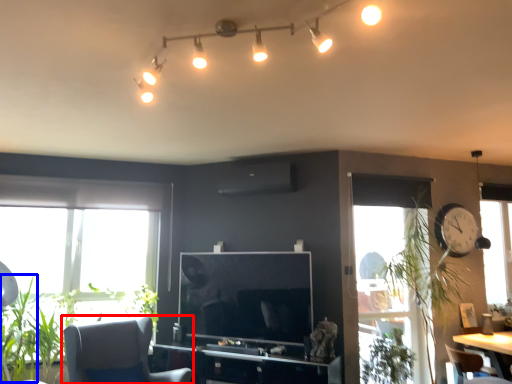
Question: Among these objects, which one is nearest to the camera, chair (highlighted by a red box) or plant (highlighted by a blue box)?

Choices:
 (A) chair
 (B) plant

Answer: (A)